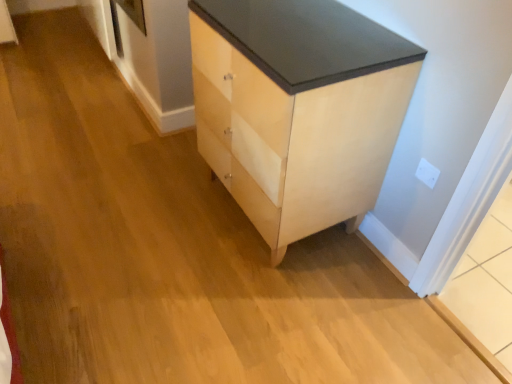
Question: Can you confirm if light wood/veneer chest of drawers at center is wider than white plastic electric outlet at upper right?

Choices:
 (A) no
 (B) yes

Answer: (B)

Question: Is white plastic electric outlet at upper right completely or partially inside light wood/veneer chest of drawers at center?

Choices:
 (A) no
 (B) yes

Answer: (A)

Question: Considering the relative positions of light wood/veneer chest of drawers at center and white plastic electric outlet at upper right in the image provided, is light wood/veneer chest of drawers at center to the left of white plastic electric outlet at upper right from the viewer's perspective?

Choices:
 (A) no
 (B) yes

Answer: (B)

Question: Considering the relative sizes of light wood/veneer chest of drawers at center and white plastic electric outlet at upper right in the image provided, is light wood/veneer chest of drawers at center thinner than white plastic electric outlet at upper right?

Choices:
 (A) yes
 (B) no

Answer: (B)

Question: From the image's perspective, does light wood/veneer chest of drawers at center appear higher than white plastic electric outlet at upper right?

Choices:
 (A) yes
 (B) no

Answer: (A)

Question: Would you say light wood/veneer chest of drawers at center is a long distance from white plastic electric outlet at upper right?

Choices:
 (A) no
 (B) yes

Answer: (A)

Question: Can you confirm if white plastic electric outlet at upper right is shorter than light wood/veneer chest of drawers at center?

Choices:
 (A) no
 (B) yes

Answer: (B)

Question: Considering the relative sizes of white plastic electric outlet at upper right and light wood/veneer chest of drawers at center in the image provided, is white plastic electric outlet at upper right wider than light wood/veneer chest of drawers at center?

Choices:
 (A) yes
 (B) no

Answer: (B)

Question: Does white plastic electric outlet at upper right appear on the right side of light wood/veneer chest of drawers at center?

Choices:
 (A) yes
 (B) no

Answer: (A)

Question: Is white plastic electric outlet at upper right looking in the opposite direction of light wood/veneer chest of drawers at center?

Choices:
 (A) yes
 (B) no

Answer: (B)

Question: Does white plastic electric outlet at upper right have a greater height compared to light wood/veneer chest of drawers at center?

Choices:
 (A) yes
 (B) no

Answer: (B)

Question: Is white plastic electric outlet at upper right not inside light wood/veneer chest of drawers at center?

Choices:
 (A) no
 (B) yes

Answer: (B)

Question: Is white plastic electric outlet at upper right taller or shorter than light wood/veneer chest of drawers at center?

Choices:
 (A) short
 (B) tall

Answer: (A)